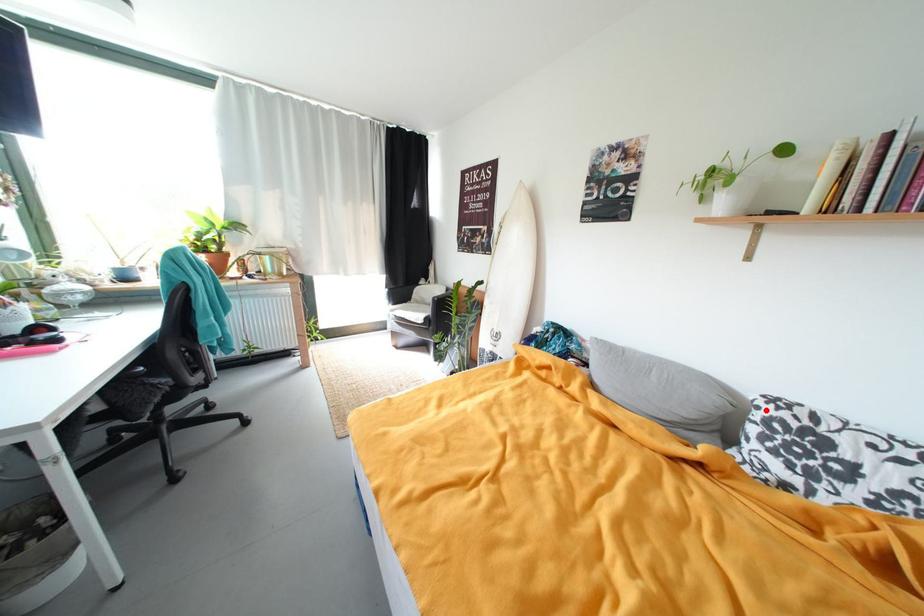
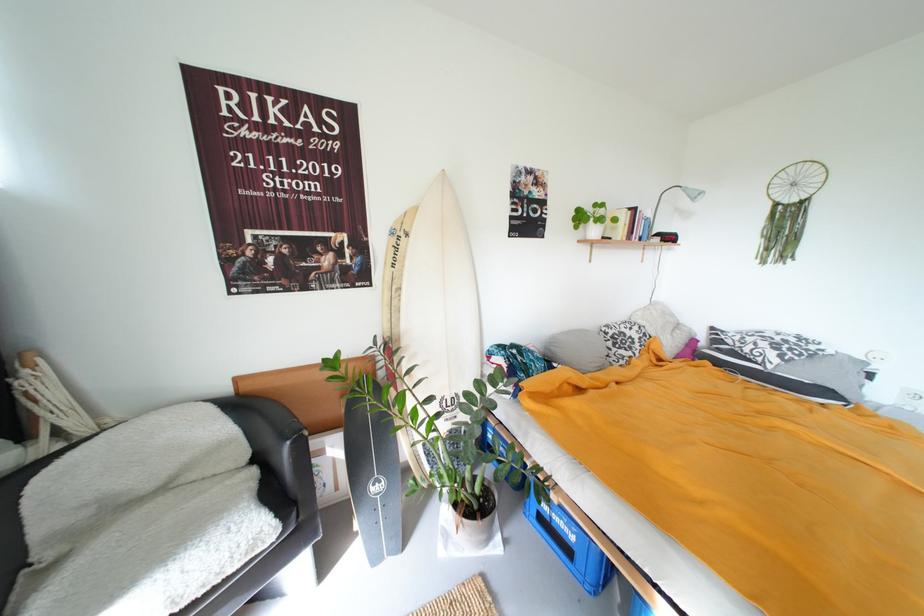
Find the pixel in the second image that matches the highlighted location in the first image.

(614, 334)